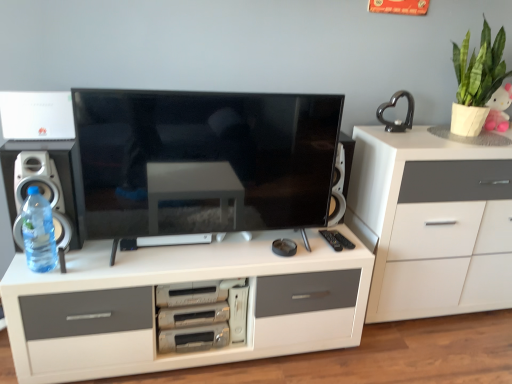
The image size is (512, 384). Identify the location of pink plush toy at upper right. (499, 109).

What do you see at coordinates (58, 173) in the screenshot? Image resolution: width=512 pixels, height=384 pixels. I see `white plastic speaker at left` at bounding box center [58, 173].

The image size is (512, 384). Identify the location of white matte cabinet at right, positioned as the second chest of drawers in bottom-to-top order. (432, 223).

Find the location of `houseplant that is above the black glossy heart at upper right (from a real-world perspective)`. houseplant that is above the black glossy heart at upper right (from a real-world perspective) is located at coordinates (477, 81).

Could you tell me if black glossy heart at upper right is facing green leafy plant in white pot at upper right?

No, black glossy heart at upper right is not facing towards green leafy plant in white pot at upper right.

Based on the photo, how many degrees apart are the facing directions of black glossy heart at upper right and green leafy plant in white pot at upper right?

6.2e-05 degrees.

Considering the relative positions of black glossy heart at upper right and green leafy plant in white pot at upper right in the image provided, is black glossy heart at upper right to the right of green leafy plant in white pot at upper right from the viewer's perspective?

No, black glossy heart at upper right is not to the right of green leafy plant in white pot at upper right.

From the picture: From a real-world perspective, between clear plastic bottle at left and white plastic speaker at left, who is vertically higher?

white plastic speaker at left.

Is white plastic speaker at left a part of clear plastic bottle at left?

No, white plastic speaker at left is not surrounded by clear plastic bottle at left.

Where is `speaker above the clear plastic bottle at left (from the image's perspective)`? speaker above the clear plastic bottle at left (from the image's perspective) is located at coordinates (58, 173).

Looking at their sizes, would you say clear plastic bottle at left is wider or thinner than white plastic speaker at left?

Considering their sizes, clear plastic bottle at left looks slimmer than white plastic speaker at left.

Where is `television on the right of metallic silver stereo at center`? The width and height of the screenshot is (512, 384). television on the right of metallic silver stereo at center is located at coordinates (206, 161).

From the picture: Is metallic silver stereo at center further to the viewer compared to black glossy tv at center?

Yes, metallic silver stereo at center is further from the viewer.

From a real-world perspective, relative to black glossy tv at center, is metallic silver stereo at center vertically above or below?

metallic silver stereo at center is situated lower than black glossy tv at center in the real world.

Is white plastic speaker at left far from clear plastic bottle at left?

No, white plastic speaker at left is not far away from clear plastic bottle at left.

Is white plastic speaker at left to the left of clear plastic bottle at left from the viewer's perspective?

Indeed, white plastic speaker at left is positioned on the left side of clear plastic bottle at left.

Is white plastic speaker at left looking in the opposite direction of clear plastic bottle at left?

Yes.

Does white plastic speaker at left have a lesser width compared to clear plastic bottle at left?

In fact, white plastic speaker at left might be wider than clear plastic bottle at left.

Is white plastic speaker at left to the left of green leafy plant in white pot at upper right from the viewer's perspective?

Yes.

From the picture: Considering the sizes of white plastic speaker at left and green leafy plant in white pot at upper right in the image, is white plastic speaker at left bigger or smaller than green leafy plant in white pot at upper right?

white plastic speaker at left is smaller than green leafy plant in white pot at upper right.

You are a GUI agent. You are given a task and a screenshot of the screen. Output one action in this format:
    pyautogui.click(x=<x>, y=<y>)
    Task: Click on the houseplant above the white plastic speaker at left (from a real-world perspective)
    This screenshot has height=384, width=512.
    Given the screenshot: What is the action you would take?
    pyautogui.click(x=477, y=81)

In terms of width, does white plastic speaker at left look wider or thinner when compared to green leafy plant in white pot at upper right?

Considering their sizes, white plastic speaker at left looks slimmer than green leafy plant in white pot at upper right.

Consider the image. Is pink plush toy at upper right placed right next to clear plastic bottle at left?

No, pink plush toy at upper right is not with clear plastic bottle at left.

Is pink plush toy at upper right positioned with its back to clear plastic bottle at left?

No, pink plush toy at upper right's orientation is not away from clear plastic bottle at left.

From a real-world perspective, between pink plush toy at upper right and clear plastic bottle at left, who is vertically higher?

pink plush toy at upper right.

Does pink plush toy at upper right contain clear plastic bottle at left?

No, clear plastic bottle at left is not a part of pink plush toy at upper right.

From a real-world perspective, who is located higher, green leafy plant in white pot at upper right or black glossy heart at upper right?

In real-world perspective, green leafy plant in white pot at upper right is above.

Could black glossy heart at upper right be considered to be inside green leafy plant in white pot at upper right?

No, black glossy heart at upper right is not a part of green leafy plant in white pot at upper right.

Considering the positions of point (460, 104) and point (393, 96), is point (460, 104) closer or farther from the camera than point (393, 96)?

Point (460, 104) appears to be closer to the viewer than point (393, 96).

Is green leafy plant in white pot at upper right placed right next to black glossy heart at upper right?

No, green leafy plant in white pot at upper right is not touching black glossy heart at upper right.

Where is `houseplant above the black glossy heart at upper right (from a real-world perspective)`? Image resolution: width=512 pixels, height=384 pixels. houseplant above the black glossy heart at upper right (from a real-world perspective) is located at coordinates (477, 81).

At what (x,y) coordinates should I click in order to perform the action: click on speaker that is behind the clear plastic bottle at left. Please return your answer as a coordinate pair (x, y). The width and height of the screenshot is (512, 384). Looking at the image, I should click on (58, 173).

Considering their positions, is metallic silver stereo at center positioned closer to clear plastic bottle at left than white plastic speaker at left?

The object closer to clear plastic bottle at left is white plastic speaker at left.

Which object lies nearer to the anchor point white matte chest of drawers at center, which is the 1th chest of drawers from bottom to top, metallic silver stereo at center or black glossy tv at center?

Based on the image, metallic silver stereo at center appears to be nearer to white matte chest of drawers at center, which is the 1th chest of drawers from bottom to top.

Estimate the real-world distances between objects in this image. Which object is further from clear plastic bottle at left, white matte cabinet at right, positioned as the 1th chest of drawers in top-to-bottom order, or black glossy heart at upper right?

white matte cabinet at right, positioned as the 1th chest of drawers in top-to-bottom order, is further to clear plastic bottle at left.

From the image, which object appears to be nearer to white matte cabinet at right, positioned as the second chest of drawers in bottom-to-top order, white plastic speaker at left or green leafy plant in white pot at upper right?

The object closer to white matte cabinet at right, positioned as the second chest of drawers in bottom-to-top order, is green leafy plant in white pot at upper right.

Looking at the image, which one is located further to white matte cabinet at right, positioned as the 1th chest of drawers in top-to-bottom order, clear plastic bottle at left or black glossy tv at center?

clear plastic bottle at left.

Which object lies nearer to the anchor point clear plastic bottle at left, white plastic speaker at left or white matte cabinet at right, positioned as the second chest of drawers in bottom-to-top order?

white plastic speaker at left is positioned closer to the anchor clear plastic bottle at left.

Which object lies further to the anchor point white matte chest of drawers at center, which is the 1th chest of drawers from bottom to top, white matte cabinet at right, positioned as the second chest of drawers in bottom-to-top order, or clear plastic bottle at left?

The object further to white matte chest of drawers at center, which is the 1th chest of drawers from bottom to top, is white matte cabinet at right, positioned as the second chest of drawers in bottom-to-top order.

Which object lies nearer to the anchor point black glossy tv at center, white plastic speaker at left or pink plush toy at upper right?

white plastic speaker at left is positioned closer to the anchor black glossy tv at center.

The height and width of the screenshot is (384, 512). What are the coordinates of `television between clear plastic bottle at left and pink plush toy at upper right from left to right` in the screenshot? It's located at (206, 161).

I want to click on home appliance situated between clear plastic bottle at left and pink plush toy at upper right from left to right, so pos(201,314).

Find the location of `appliance between black glossy tv at center and green leafy plant in white pot at upper right in the horizontal direction`. appliance between black glossy tv at center and green leafy plant in white pot at upper right in the horizontal direction is located at coordinates (394, 106).

The height and width of the screenshot is (384, 512). I want to click on home appliance between white plastic speaker at left and white matte chest of drawers at center, which is the 1th chest of drawers from bottom to top, so click(201, 314).